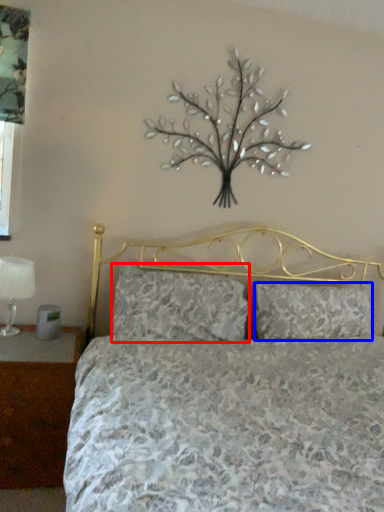
Question: Which object is closer to the camera taking this photo, pillow (highlighted by a red box) or pillow (highlighted by a blue box)?

Choices:
 (A) pillow
 (B) pillow

Answer: (A)